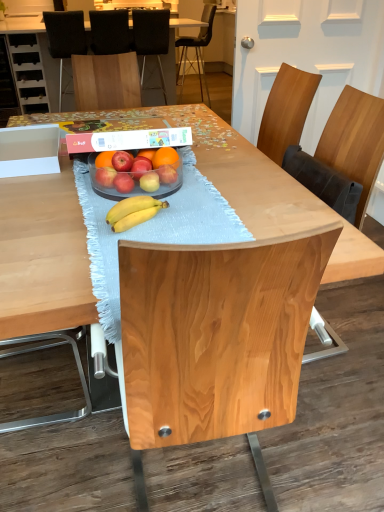
In order to click on empty space that is to the right of matte red apple at center, the 5th apple viewed from the left in this screenshot , I will do `click(200, 197)`.